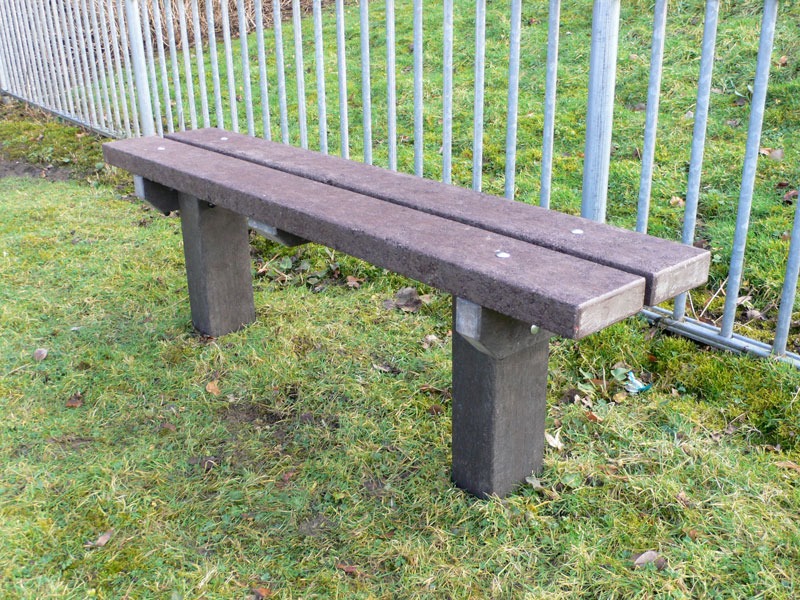
Find the location of a particular element. bench legs is located at coordinates (510, 425), (204, 282).